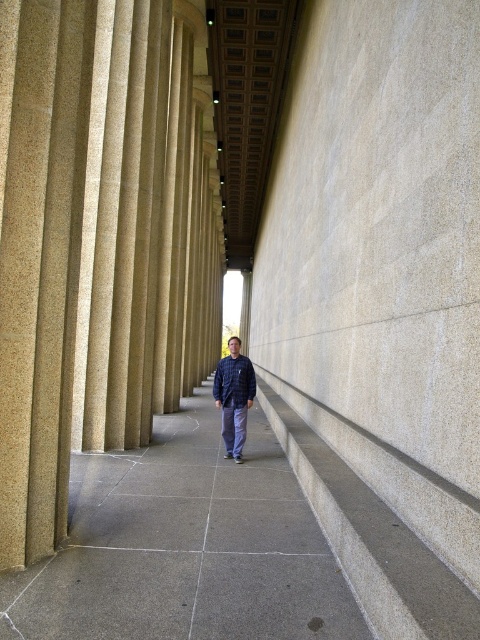
You are a delivery robot navigating through the colonnade. Your destination is the gray concrete pavement at center marked by point (184, 547). The colonnade has columns arranged in a grid. To avoid obstacles, you need to move in a straight line from your current position to the destination. Is there a column blocking your path?

The point (184, 547) marks the gray concrete pavement at center, which is the destination. Since the columns are arranged in a grid and the person is positioned centrally, the straight path to the center is likely unobstructed by columns. Therefore, there is no column blocking the path.

You are a visitor at this historical building and want to walk towards the entrance. You see the gray concrete pavement at center and the gray concrete stairs at center. Which one is larger in size?

The gray concrete pavement at center is bigger than the gray concrete stairs at center, so the gray concrete pavement at center is larger in size.

You are an assistant helping someone choose an outfit for a formal event. The person has two options in the image, a dark blue jacket at center and a dark blue cotton sweatshirt at center. Which one is more appropriate for a formal event based on their positioning in the image?

The dark blue jacket at center is located below the dark blue cotton sweatshirt at center, so the jacket is likely worn over the sweatshirt. Since jackets are typically more formal than sweatshirts, the dark blue jacket at center is more appropriate for a formal event.